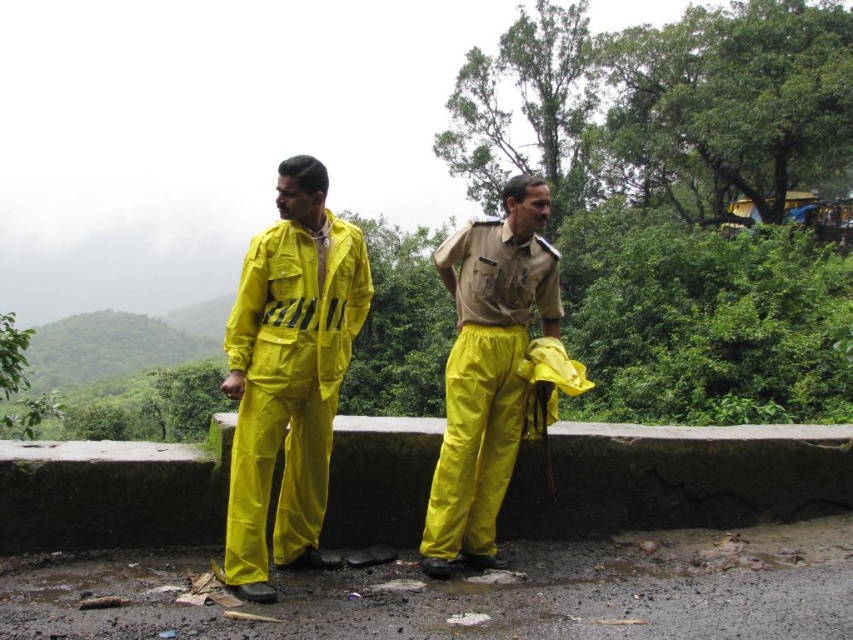
Question: Is rubberized yellow jumpsuit at center positioned at the back of yellow matte raincoat at center?

Choices:
 (A) yes
 (B) no

Answer: (B)

Question: Which point appears closest to the camera in this image?

Choices:
 (A) (344, 364)
 (B) (492, 531)
 (C) (245, 570)

Answer: (C)

Question: Can you confirm if yellow matte raincoat at center is bigger than yellow matte pants at center?

Choices:
 (A) yes
 (B) no

Answer: (A)

Question: Which object is the closest to the yellow matte pants at center?

Choices:
 (A) yellow matte raincoat at center
 (B) rubberized yellow jumpsuit at center

Answer: (B)

Question: From the image, what is the correct spatial relationship of rubberized yellow jumpsuit at center in relation to yellow matte raincoat at center?

Choices:
 (A) left
 (B) right

Answer: (B)

Question: Among these objects, which one is nearest to the camera?

Choices:
 (A) yellow matte pants at center
 (B) rubberized yellow jumpsuit at center
 (C) yellow matte raincoat at center

Answer: (B)